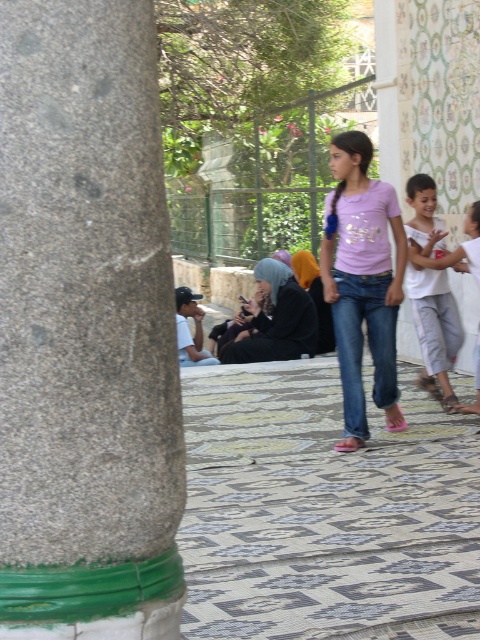
Question: Can you confirm if white cotton shirt at center-right is positioned to the right of black matte hijab at center?

Choices:
 (A) no
 (B) yes

Answer: (B)

Question: Can you confirm if matte pink t-shirt at center is positioned to the right of white cotton shirt at center-right?

Choices:
 (A) no
 (B) yes

Answer: (A)

Question: Which point is farther to the camera?

Choices:
 (A) white cotton shirt at center-right
 (B) matte pink t-shirt at center

Answer: (A)

Question: Which object appears closest to the camera in this image?

Choices:
 (A) black matte hijab at center
 (B) green concrete pillar at left
 (C) white cotton shirt at center-right

Answer: (B)

Question: Does green concrete pillar at left have a larger size compared to matte pink t-shirt at center?

Choices:
 (A) no
 (B) yes

Answer: (A)

Question: Which object is positioned closest to the green concrete pillar at left?

Choices:
 (A) black matte hijab at center
 (B) matte pink t-shirt at center

Answer: (B)